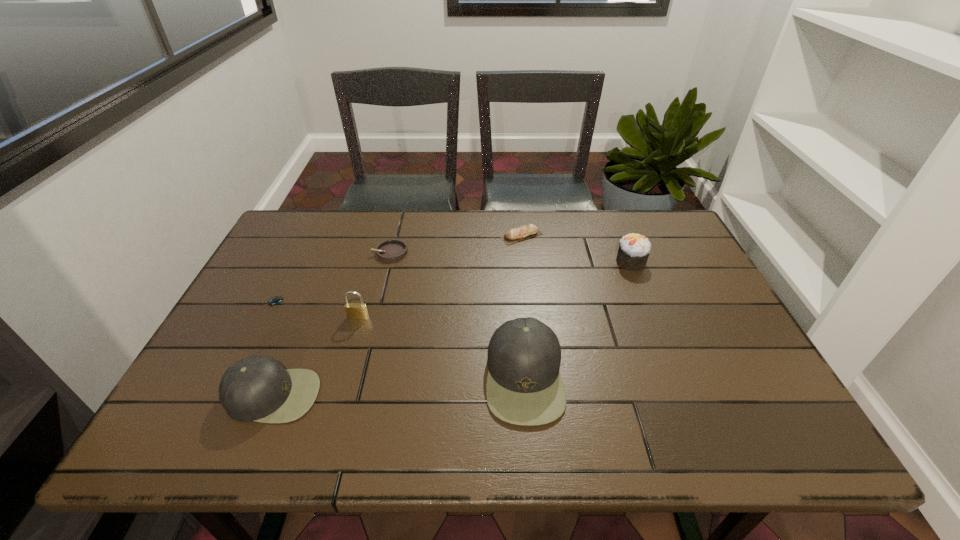
Where is `the shorter cap`? This screenshot has height=540, width=960. the shorter cap is located at coordinates (256, 388).

The width and height of the screenshot is (960, 540). Find the location of `the right cap`. the right cap is located at coordinates (524, 386).

In order to click on the tallest object in this screenshot , I will do `click(524, 386)`.

Locate an element on the screen. The image size is (960, 540). the rightmost object is located at coordinates (634, 249).

This screenshot has width=960, height=540. In order to click on the second shortest object in this screenshot , I will do `click(390, 251)`.

You are a GUI agent. You are given a task and a screenshot of the screen. Output one action in this format:
    pyautogui.click(x=<x>, y=<y>)
    Task: Click on the pita bread
    The width and height of the screenshot is (960, 540).
    Given the screenshot: What is the action you would take?
    pyautogui.click(x=520, y=233)

This screenshot has width=960, height=540. Find the location of `the fifth farthest object`. the fifth farthest object is located at coordinates (355, 311).

I want to click on the shortest object, so click(275, 300).

Where is `mouse`? The image size is (960, 540). mouse is located at coordinates (275, 300).

Locate an element on the screen. This screenshot has width=960, height=540. free space located 0.150m on the brim of the taller cap is located at coordinates (420, 377).